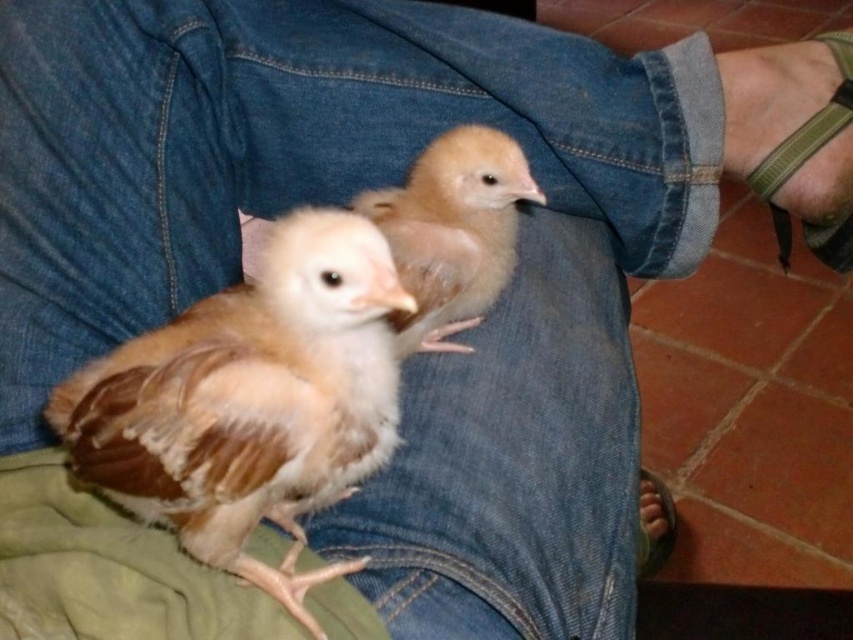
Question: Is brown fluffy chick at center wider than light brown fluffy chick at center?

Choices:
 (A) no
 (B) yes

Answer: (B)

Question: Is the position of brown fluffy chick at center more distant than that of brown leather foot at lower right?

Choices:
 (A) yes
 (B) no

Answer: (B)

Question: Considering the real-world distances, which object is closest to the green fabric strap at lower right?

Choices:
 (A) brown fluffy chick at center
 (B) light brown fluffy chick at center
 (C) brown leather foot at lower right

Answer: (B)

Question: Which of the following is the closest to the observer?

Choices:
 (A) 440,234
 (B) 254,420

Answer: (B)

Question: Estimate the real-world distances between objects in this image. Which object is closer to the green fabric strap at lower right?

Choices:
 (A) brown fluffy chick at center
 (B) brown leather foot at lower right
 (C) light brown fluffy chick at center

Answer: (C)

Question: Does brown fluffy chick at center appear on the left side of green fabric strap at lower right?

Choices:
 (A) yes
 (B) no

Answer: (A)